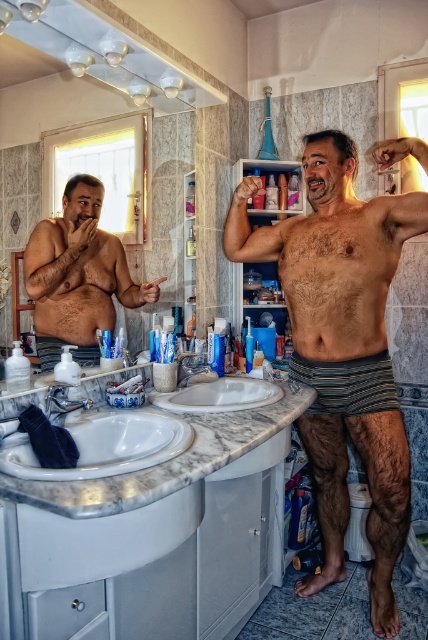
You are designing a bathroom layout and want to place a new mirror so that it reflects the point at coordinates point (77, 275). Given the current bathroom setup described, where should you position the mirror to ensure this reflection?

The mirror should be placed opposite to the point (77, 275) to reflect it. Since the matte black torso at left is represented by point (77, 275), the mirror must be positioned on the right side of the bathroom to capture and reflect that point.

You are a painter standing in the bathroom and want to paint the matte black torso at left and the white glossy sink at lower left. Which object should you paint first if you want to start with the one that is higher up?

The matte black torso at left is above the white glossy sink at lower left, so you should paint the matte black torso at left first.

You are a delivery person who needs to place a small package on the bathroom countertop between the striped cotton shorts at center and the white glossy sink at lower left. The package requires at least 20 inches of space to be placed safely. Can you fit it there?

The striped cotton shorts at center is 31.35 inches away from the white glossy sink at lower left, which is more than the required 20 inches. Therefore, the package can be safely placed between them.